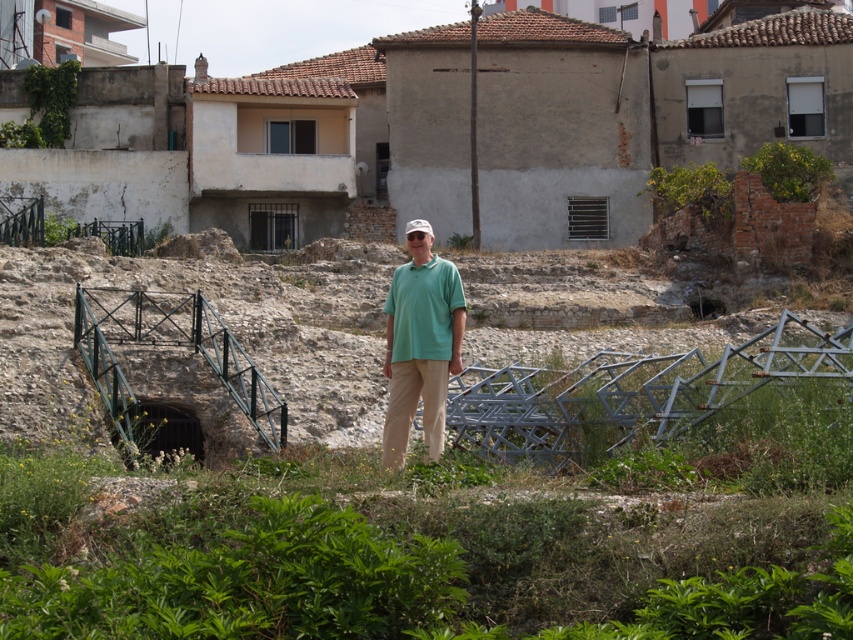
Question: Does green matte shirt at center lie behind green matte polo shirt at center?

Choices:
 (A) no
 (B) yes

Answer: (A)

Question: Which of the following is the farthest from the observer?

Choices:
 (A) green matte shirt at center
 (B) green matte polo shirt at center

Answer: (B)

Question: Is green matte shirt at center bigger than green matte polo shirt at center?

Choices:
 (A) no
 (B) yes

Answer: (B)

Question: Can you confirm if green matte shirt at center is positioned below green matte polo shirt at center?

Choices:
 (A) yes
 (B) no

Answer: (B)